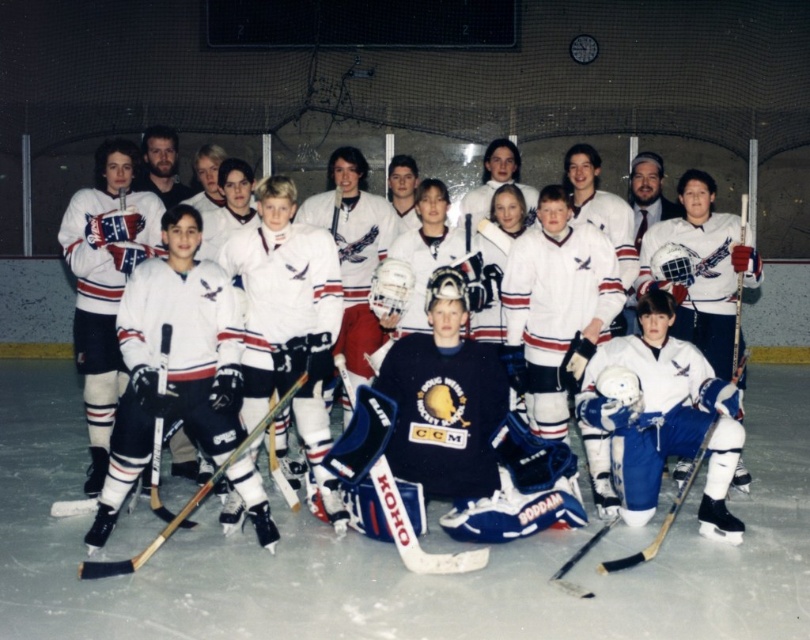
Question: Is white matte hockey jerseys at center further to camera compared to blue plastic hockey stick at center?

Choices:
 (A) yes
 (B) no

Answer: (A)

Question: Is white matte hockey jerseys at center wider than blue plastic hockey stick at center?

Choices:
 (A) yes
 (B) no

Answer: (A)

Question: Among these objects, which one is nearest to the camera?

Choices:
 (A) white matte hockey jerseys at center
 (B) wooden hockey stick at center
 (C) blue plastic hockey stick at center

Answer: (B)

Question: Which point is closer to the camera taking this photo?

Choices:
 (A) (258, 429)
 (B) (467, 563)

Answer: (B)

Question: Which point is farther from the camera taking this photo?

Choices:
 (A) (186, 500)
 (B) (342, 381)
 (C) (484, 204)

Answer: (C)

Question: Is blue plastic hockey stick at center behind wooden hockey stick at center?

Choices:
 (A) no
 (B) yes

Answer: (B)